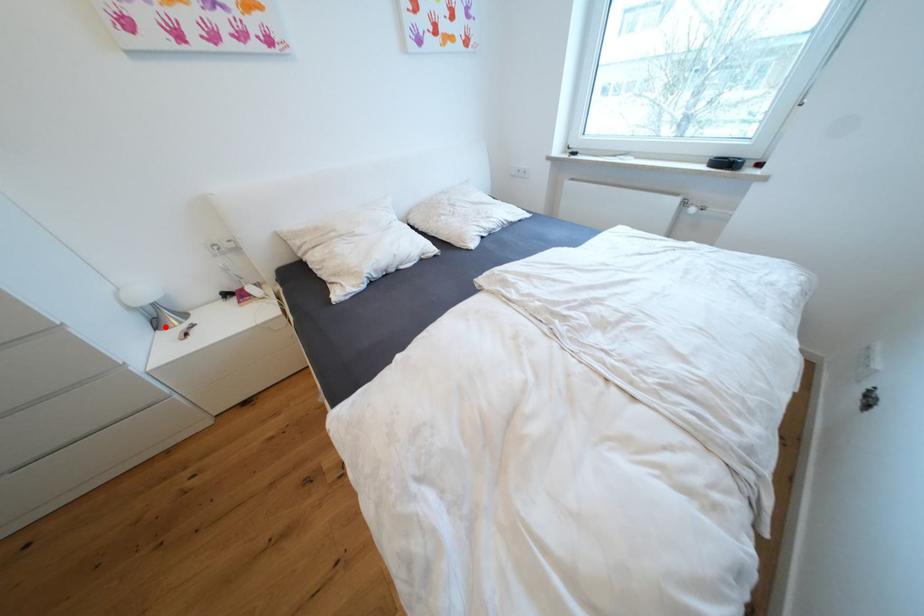
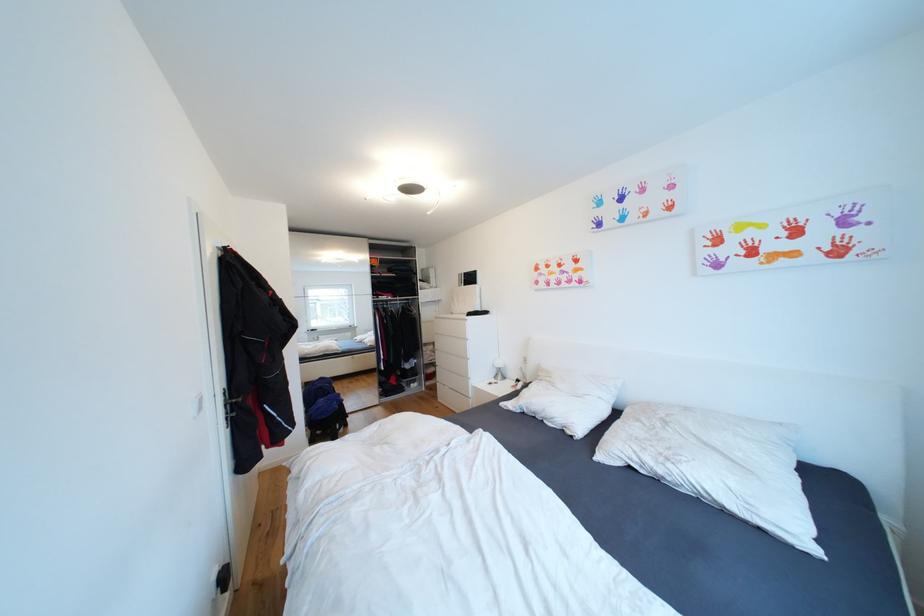
Find the pixel in the second image that matches the highlighted location in the first image.

(503, 378)